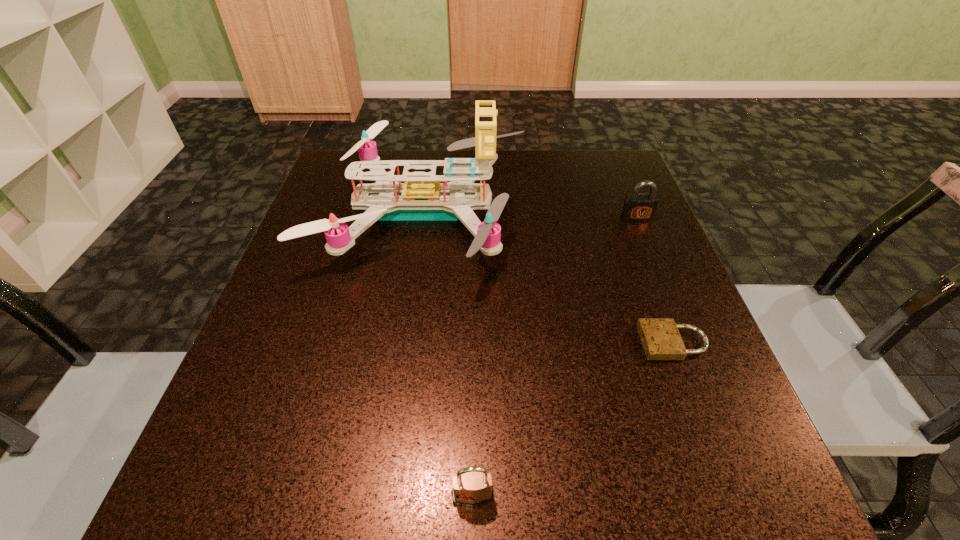
Image resolution: width=960 pixels, height=540 pixels. I want to click on drone, so click(x=420, y=198).

Where is `the farthest padlock`? Image resolution: width=960 pixels, height=540 pixels. the farthest padlock is located at coordinates (637, 207).

Locate an element on the screen. The height and width of the screenshot is (540, 960). the nearest padlock is located at coordinates [x=471, y=488].

Image resolution: width=960 pixels, height=540 pixels. Identify the location of the leftmost padlock. pos(471,488).

This screenshot has width=960, height=540. Identify the location of the shortest padlock. (661, 340).

Identify the location of the third farthest object. (661, 340).

Find the location of `vacant space situated 0.090m on the front-facing side of the drone`. vacant space situated 0.090m on the front-facing side of the drone is located at coordinates (567, 213).

Where is `vacant space located 0.130m on the front of the farthest padlock near the keyhole`? The height and width of the screenshot is (540, 960). vacant space located 0.130m on the front of the farthest padlock near the keyhole is located at coordinates tap(656, 262).

Where is `free spot located on the left of the nearest padlock`? Image resolution: width=960 pixels, height=540 pixels. free spot located on the left of the nearest padlock is located at coordinates (398, 496).

Where is `free space located on the keyhole side of the shortest padlock`? This screenshot has height=540, width=960. free space located on the keyhole side of the shortest padlock is located at coordinates (523, 342).